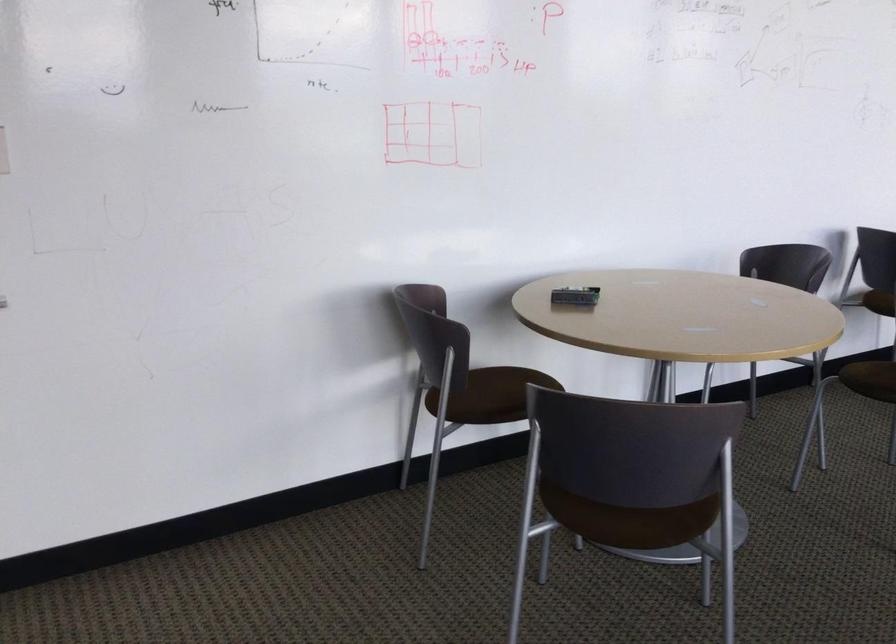
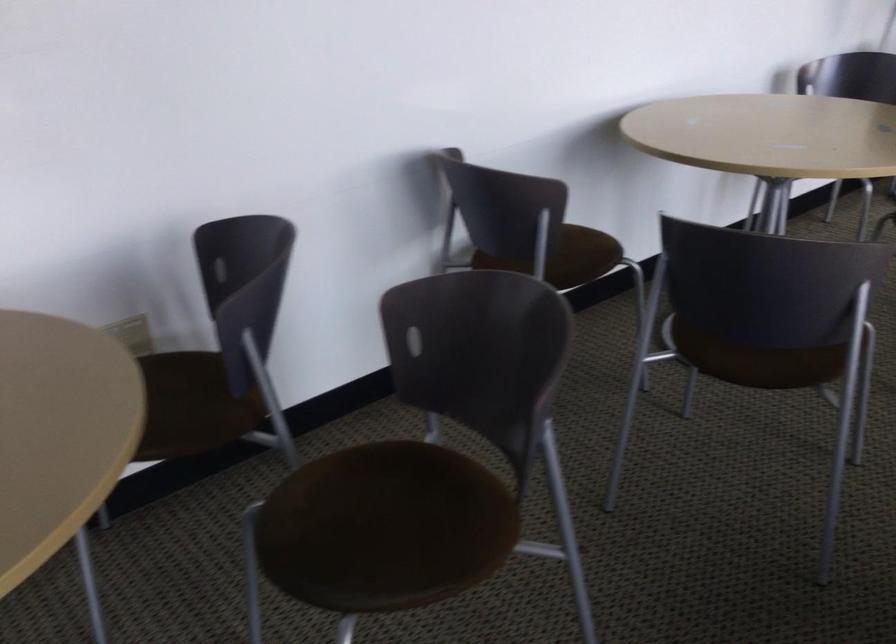
Which direction would the cameraman need to move to produce the second image?

The cameraman moved toward right, forward.